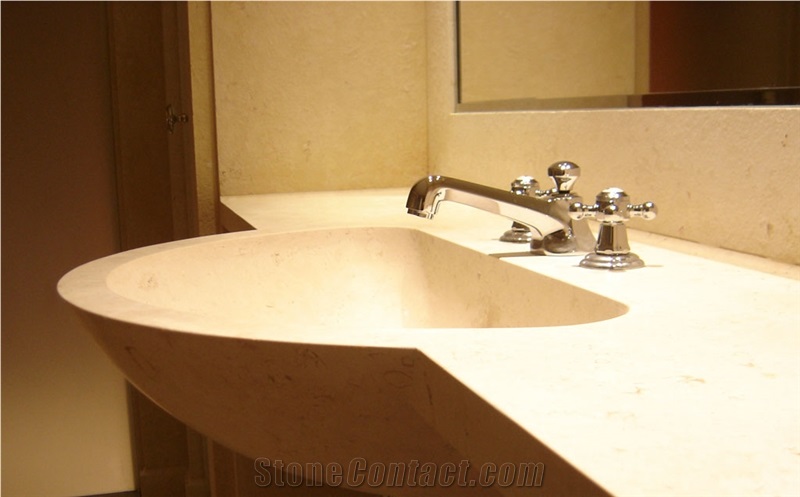
Find the location of a particular element. mirror is located at coordinates (565, 48).